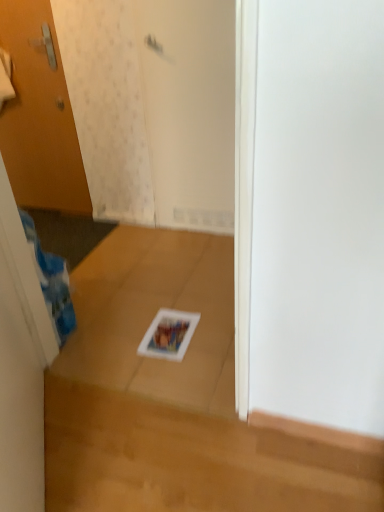
You are a GUI agent. You are given a task and a screenshot of the screen. Output one action in this format:
    pyautogui.click(x=<x>, y=<y>)
    Task: Click on the free spot behind matte white magazine at center
    The height and width of the screenshot is (512, 384).
    Given the screenshot: What is the action you would take?
    pyautogui.click(x=170, y=301)